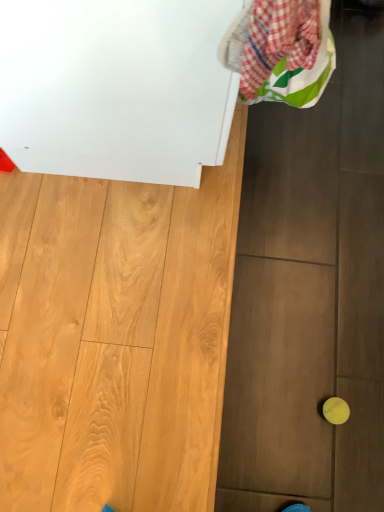
At what (x,y) coordinates should I click in order to perform the action: click on vacant space in front of yellow rubber ball at lower right. Please return your answer as a coordinate pair (x, y). This screenshot has width=384, height=512. Looking at the image, I should click on (334, 464).